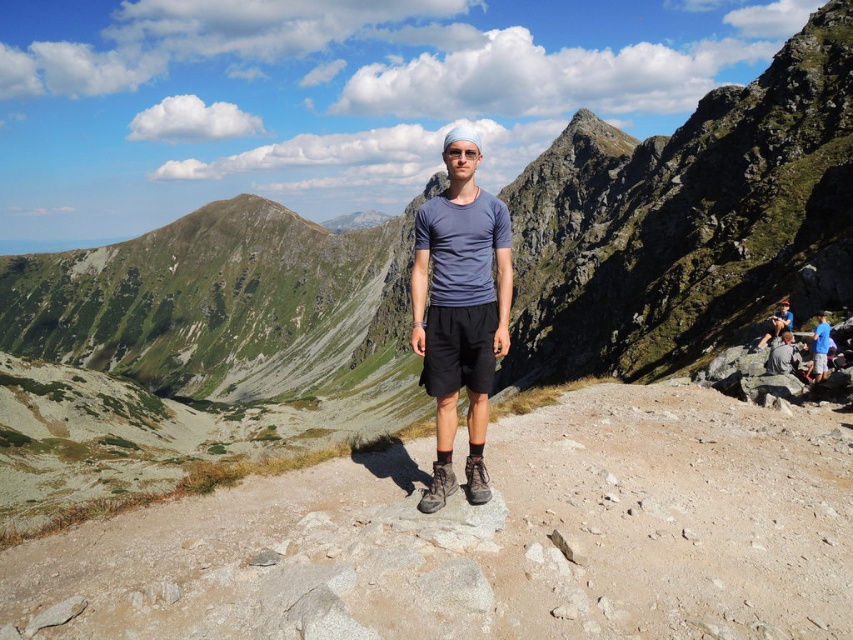
You are a hiker standing at the point with coordinates point (x=415, y=298) and want to reach the point with coordinates point (x=785, y=321). Which direction should you move relative to the current position?

You should move backward because point (x=415, y=298) is in front of point (x=785, y=321). So the target point is behind your current position.

You are a photographer planning to take a panoramic shot of the mountain landscape. You want to ensure the blue fabric shirt at right is positioned exactly at the center of the frame. How far to the left should you move the shirt horizontally to achieve this?

The blue fabric shirt at right is currently at position 0.544 on the horizontal axis. To center it, you need to move it left by 0.544 units to reach the center point at 0.5.